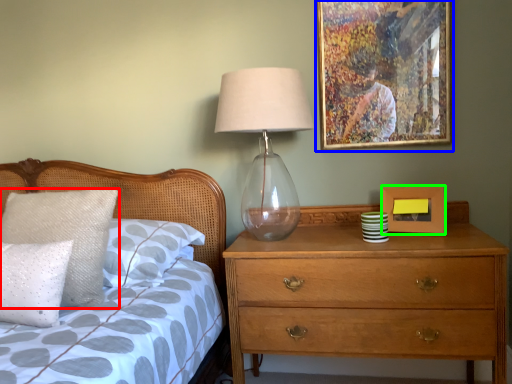
Question: Which object is the farthest from pillow (highlighted by a red box)? Choose among these: picture frame (highlighted by a blue box) or picture frame (highlighted by a green box).

Choices:
 (A) picture frame
 (B) picture frame

Answer: (B)